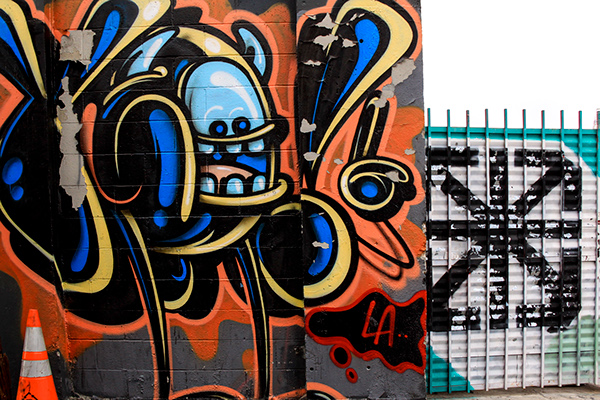
What are the coordinates of `murals` in the screenshot? It's located at (268, 182).